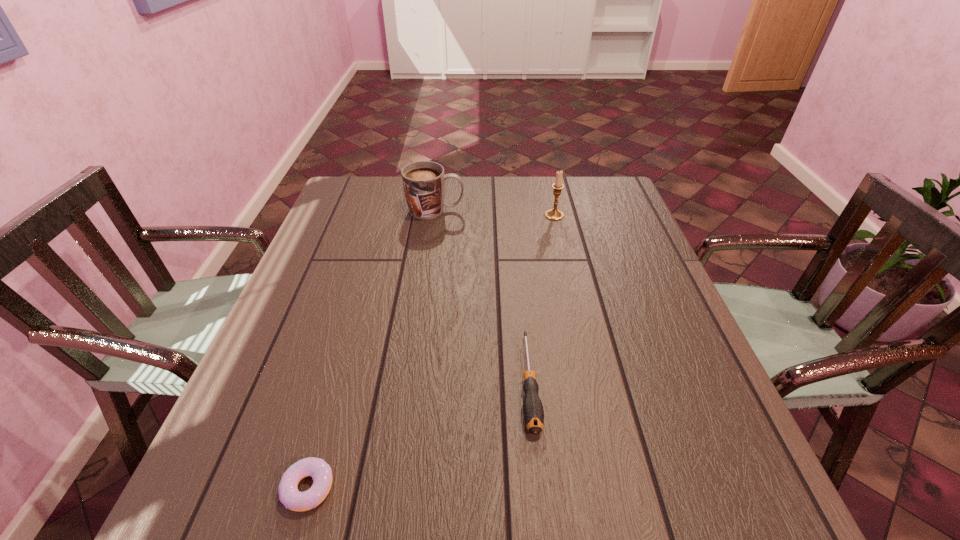
Locate an element on the screen. The width and height of the screenshot is (960, 540). blank space at the near left corner is located at coordinates (260, 491).

Identify the location of blank region between the second nearest object and the mug. (482, 296).

What are the coordinates of `vacant point located between the mug and the rightmost object` in the screenshot? It's located at (494, 213).

Locate an element on the screen. This screenshot has height=540, width=960. empty space between the shortest object and the mug is located at coordinates (372, 349).

The height and width of the screenshot is (540, 960). Find the location of `vacant space in between the rightmost object and the shortest object`. vacant space in between the rightmost object and the shortest object is located at coordinates (431, 352).

Find the location of a particular element. This screenshot has height=540, width=960. vacant area that lies between the candle holder and the third farthest object is located at coordinates (541, 299).

Identify the location of vacant space in between the nearest object and the candle holder. This screenshot has width=960, height=540. (431, 352).

Where is `vacant space in between the third object from right to left and the second object from right to left`? This screenshot has width=960, height=540. vacant space in between the third object from right to left and the second object from right to left is located at coordinates (x=482, y=296).

Locate an element on the screen. free space between the rightmost object and the third object from left to right is located at coordinates (541, 299).

At what (x,y) coordinates should I click in order to perform the action: click on free space between the shortest object and the third object from left to right. Please return your answer as a coordinate pair (x, y). This screenshot has width=960, height=540. Looking at the image, I should click on (419, 435).